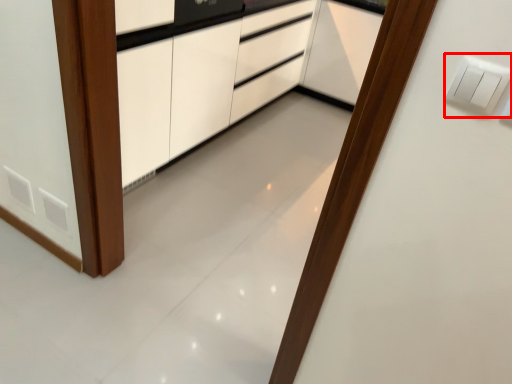
Question: From the image's perspective, where is light switch (annotated by the red box) located relative to cabinetry?

Choices:
 (A) below
 (B) above

Answer: (A)